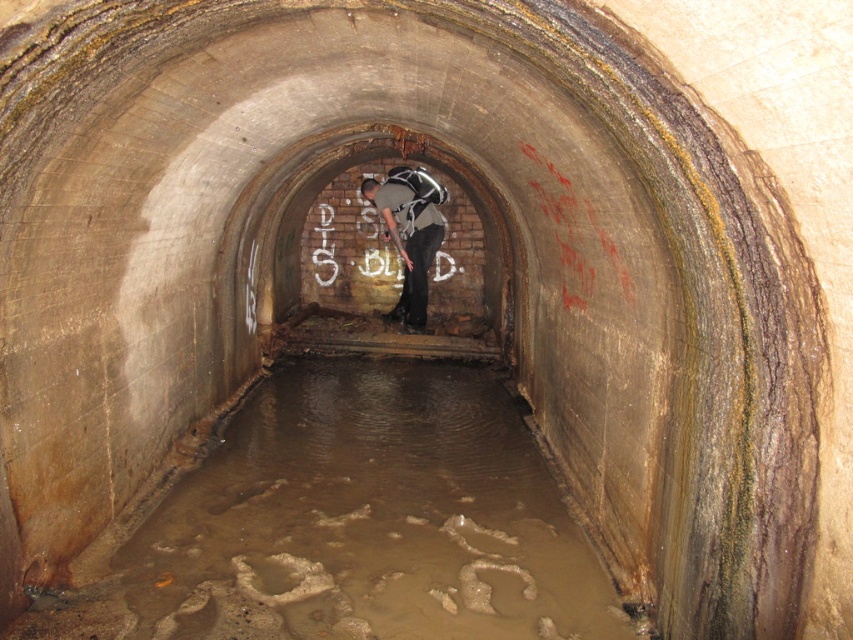
You are a maintenance worker entering the tunnel and see the muddy concrete flood at center and the white chalk graffiti at center. Which object is closer to you?

The muddy concrete flood at center is closer to the viewer than the white chalk graffiti at center.

You are a maintenance worker in an underground tunnel. You see a muddy concrete flood at center and a white chalk graffiti at center. Which object takes up more space in the tunnel?

The muddy concrete flood at center has a larger size compared to white chalk graffiti at center, so the muddy concrete flood at center takes up more space in the tunnel.